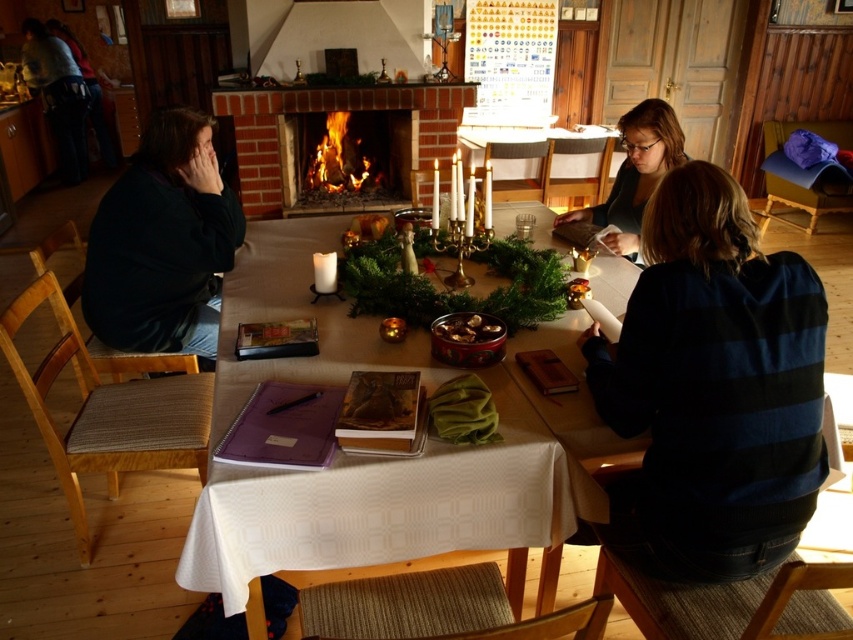
Question: Is white textured table at center wider than dark matte jacket at left?

Choices:
 (A) no
 (B) yes

Answer: (B)

Question: Among these points, which one is farthest from the camera?

Choices:
 (A) (264, 177)
 (B) (577, 429)
 (C) (480, 314)

Answer: (A)

Question: Can you confirm if dark blue striped sweater at lower right is wider than dark matte jacket at left?

Choices:
 (A) yes
 (B) no

Answer: (B)

Question: Which of the following is the closest to the observer?

Choices:
 (A) shiny metallic bowl at center
 (B) white textured table at center
 (C) brick fireplace at center

Answer: (B)

Question: Is white textured table at center thinner than brick fireplace at center?

Choices:
 (A) no
 (B) yes

Answer: (B)

Question: Which of the following is the farthest from the observer?

Choices:
 (A) dark matte jacket at left
 (B) shiny metallic bowl at center
 (C) matte black sweater at center
 (D) white textured table at center

Answer: (C)